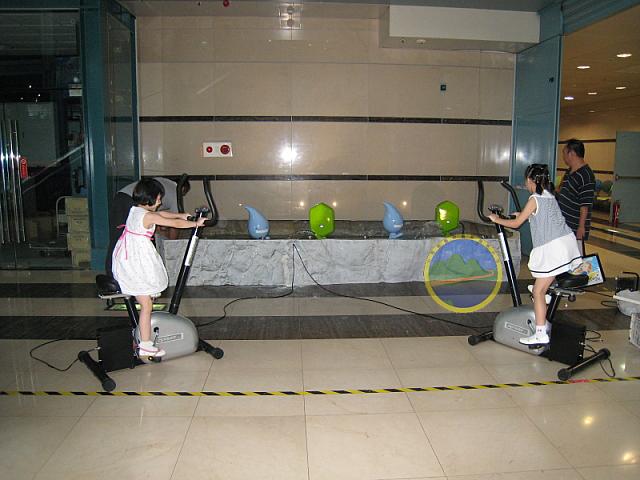
Locate an element on the screen. The width and height of the screenshot is (640, 480). exercise bike black cord is located at coordinates (260, 299), (402, 309).